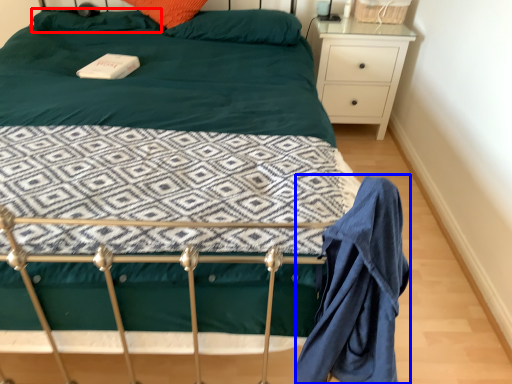
Question: Among these objects, which one is nearest to the camera, pillow (highlighted by a red box) or robe (highlighted by a blue box)?

Choices:
 (A) pillow
 (B) robe

Answer: (B)